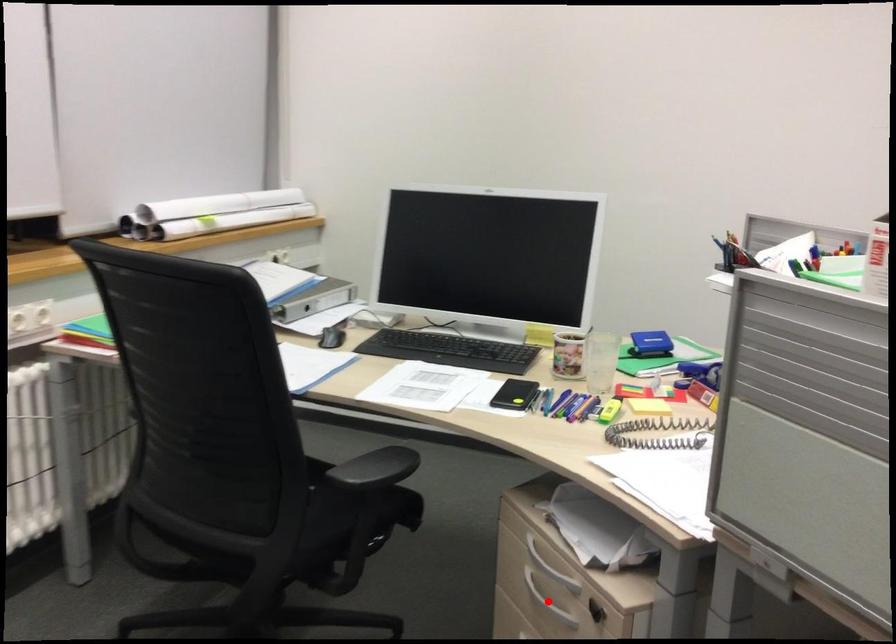
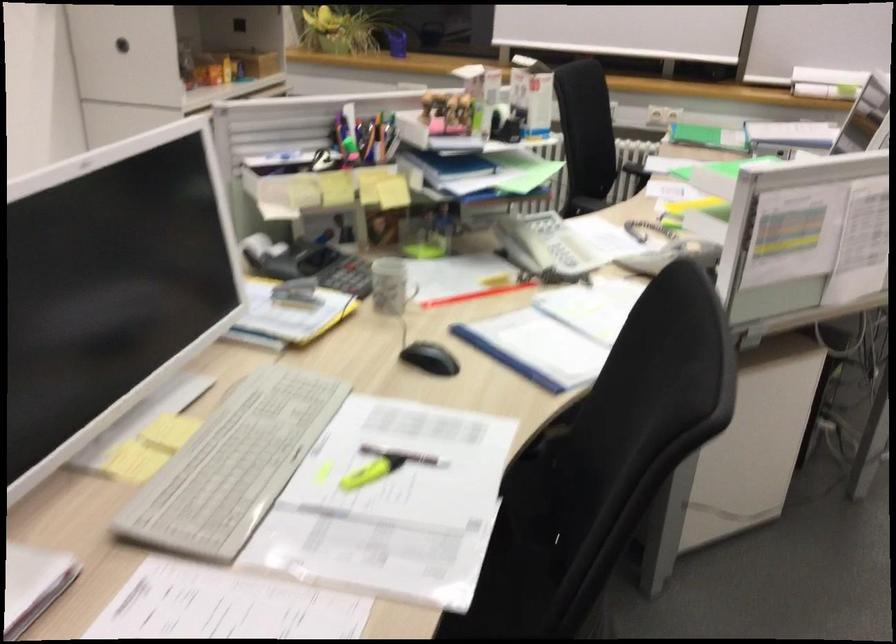
Question: I am providing you with two images of the same scene from different viewpoints. A red point is marked on the first image. Is the red point's position out of view in image 2?

Choices:
 (A) Yes
 (B) No

Answer: (A)